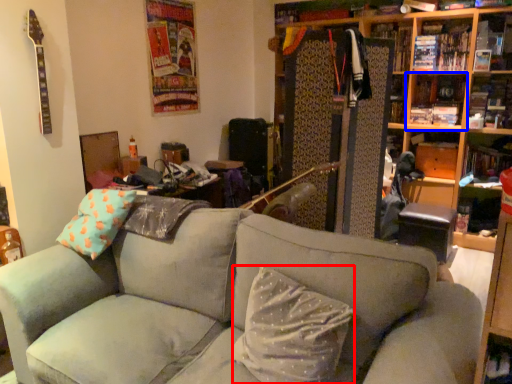
Question: Which object is closer to the camera taking this photo, pillow (highlighted by a red box) or shelf (highlighted by a blue box)?

Choices:
 (A) pillow
 (B) shelf

Answer: (A)